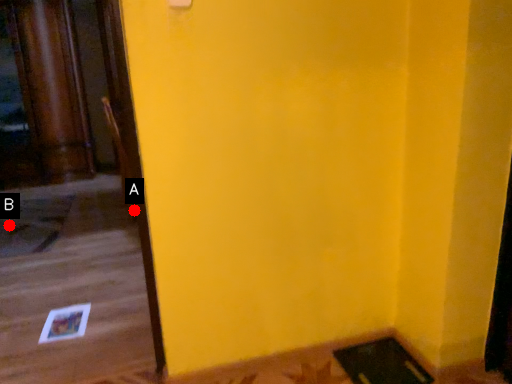
Question: Two points are circled on the image, labeled by A and B beside each circle. Which of the following is the closest to the observer?

Choices:
 (A) A is closer
 (B) B is closer

Answer: (A)